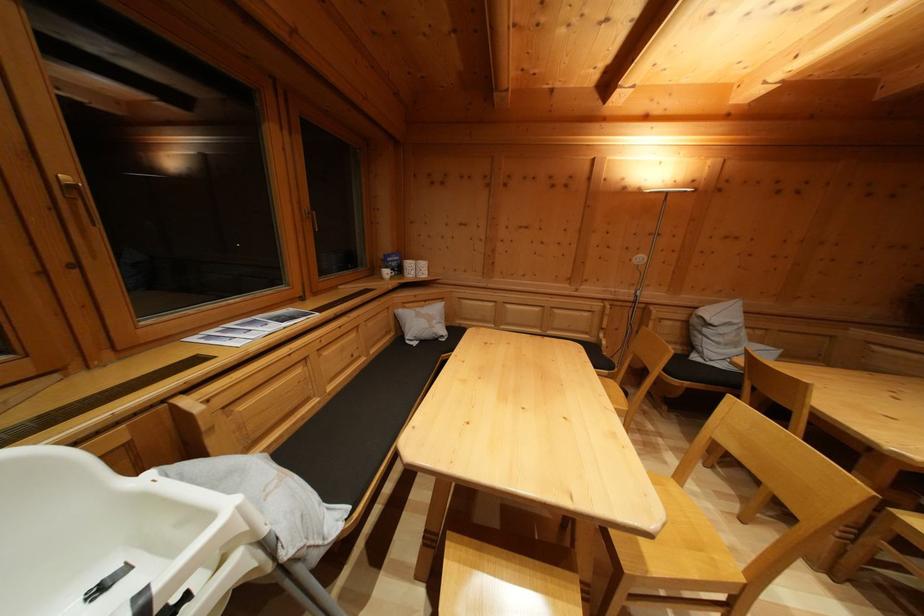
Locate an element on the screen. This screenshot has height=616, width=924. black seatbelt buckle is located at coordinates (106, 582).